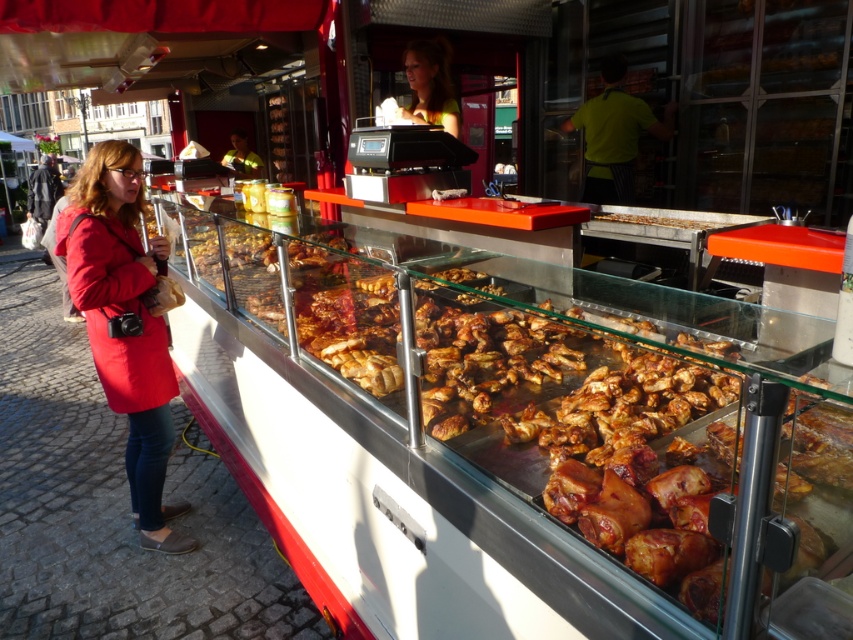
You are a customer at the food stall and want to place an order. You see the brown crispy bread at center and the reflective yellow jacket at center on the counter. Which item takes up more space horizontally?

The reflective yellow jacket at center takes up more horizontal space because its width is greater than the brown crispy bread at center.

You are a customer at the food stall and want to locate the brown crispy bread at center. According to the stall layout, where would you find it?

The brown crispy bread at center is located at the 2D coordinates point [657,220].